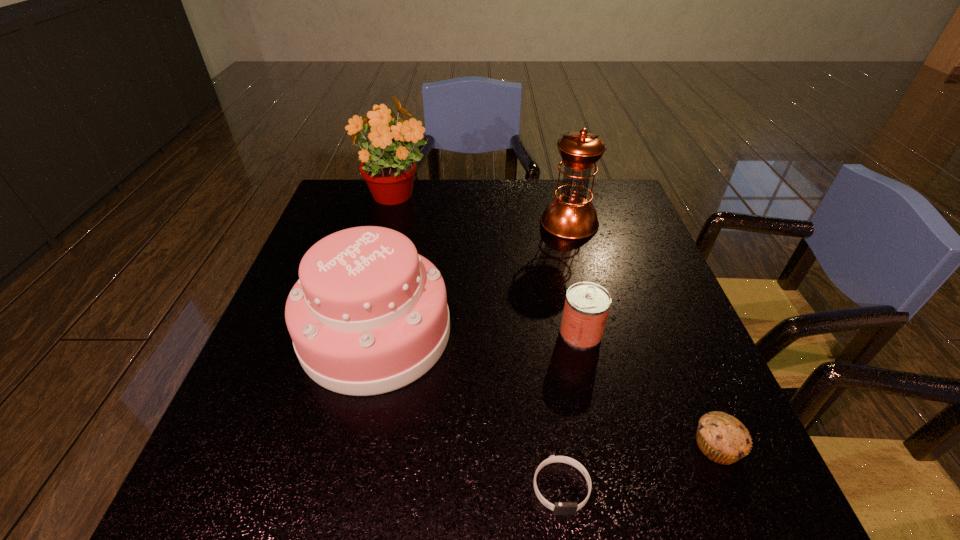
The width and height of the screenshot is (960, 540). Find the location of `free space located 0.180m on the right of the third shortest object`. free space located 0.180m on the right of the third shortest object is located at coordinates (684, 333).

The image size is (960, 540). I want to click on vacant space situated 0.190m on the back of the muffin, so click(673, 342).

Where is `flowerpot that is positioned at the far edge`? Image resolution: width=960 pixels, height=540 pixels. flowerpot that is positioned at the far edge is located at coordinates (389, 168).

Locate an element on the screen. The height and width of the screenshot is (540, 960). oil lamp that is positioned at the far edge is located at coordinates (571, 215).

The height and width of the screenshot is (540, 960). Identify the location of muffin at the near edge. (722, 438).

At what (x,y) coordinates should I click in order to perform the action: click on wristband that is positioned at the near edge. Please return your answer as a coordinate pair (x, y). This screenshot has height=540, width=960. Looking at the image, I should click on (559, 508).

Find the location of a particular element. Image resolution: width=960 pixels, height=540 pixels. flowerpot that is at the left edge is located at coordinates (389, 168).

You are a GUI agent. You are given a task and a screenshot of the screen. Output one action in this format:
    pyautogui.click(x=<x>, y=<y>)
    Task: Click on the birthday cake that is at the left edge
    The height and width of the screenshot is (540, 960).
    Given the screenshot: What is the action you would take?
    pyautogui.click(x=369, y=315)

This screenshot has width=960, height=540. In order to click on oil lamp located at the right edge in this screenshot , I will do `click(571, 215)`.

Where is `muffin at the right edge`? muffin at the right edge is located at coordinates (722, 438).